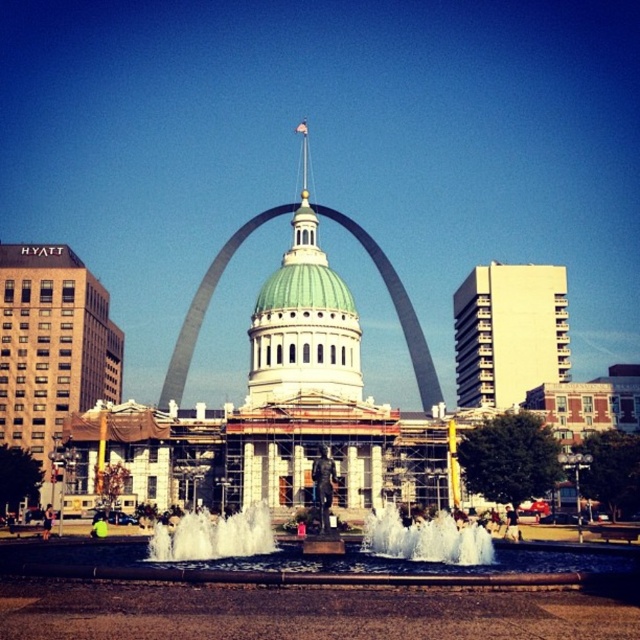
Question: Among these points, which one is farthest from the camera?

Choices:
 (A) (426, 545)
 (B) (266, 326)

Answer: (B)

Question: Is green dome at center closer to camera compared to white frothy water at center?

Choices:
 (A) no
 (B) yes

Answer: (A)

Question: Is green dome at center to the right of white frothy water at center from the viewer's perspective?

Choices:
 (A) yes
 (B) no

Answer: (B)

Question: Can you confirm if green dome at center is bigger than white frothy water at center?

Choices:
 (A) yes
 (B) no

Answer: (A)

Question: Which point is closer to the camera?

Choices:
 (A) (484, 545)
 (B) (333, 336)

Answer: (A)

Question: Which object appears farthest from the camera in this image?

Choices:
 (A) green dome at center
 (B) white frothy water at center

Answer: (A)